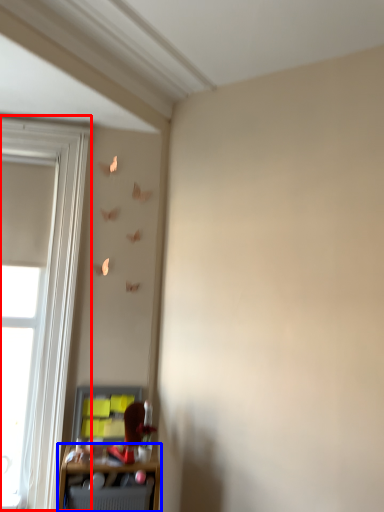
Question: Which object is further to the camera taking this photo, window (highlighted by a red box) or shelf (highlighted by a blue box)?

Choices:
 (A) window
 (B) shelf

Answer: (A)